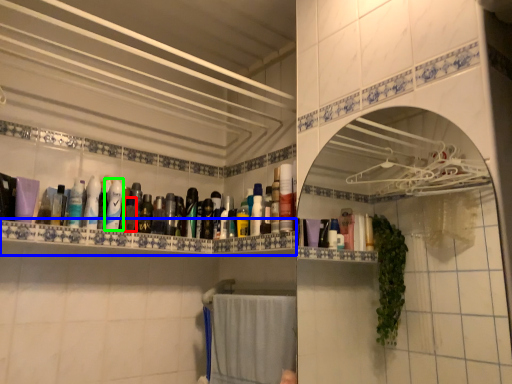
Question: Which object is the closest to the mouthwash (highlighted by a red box)? Choose among these: shelve (highlighted by a blue box) or mouthwash (highlighted by a green box).

Choices:
 (A) shelve
 (B) mouthwash

Answer: (B)